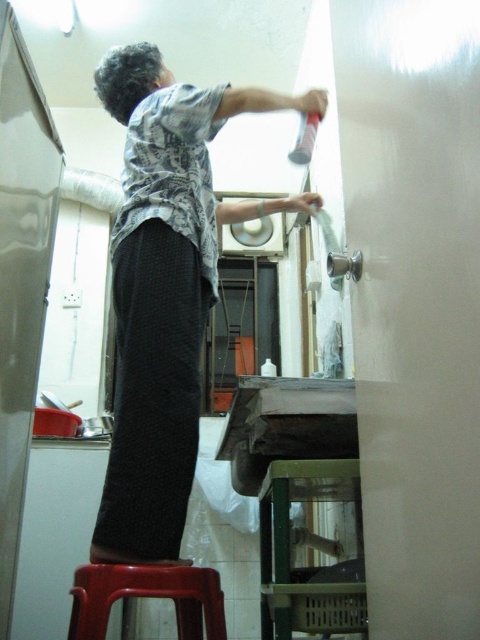
Who is lower down, gray cotton shirt at upper center or plastic stool at lower left?

plastic stool at lower left

Between point (202, 97) and point (99, 616), which one is positioned behind?

Positioned behind is point (202, 97).

Is point (180, 284) positioned behind point (196, 625)?

Yes, point (180, 284) is farther from viewer.

The height and width of the screenshot is (640, 480). I want to click on gray cotton shirt at upper center, so tap(166, 289).